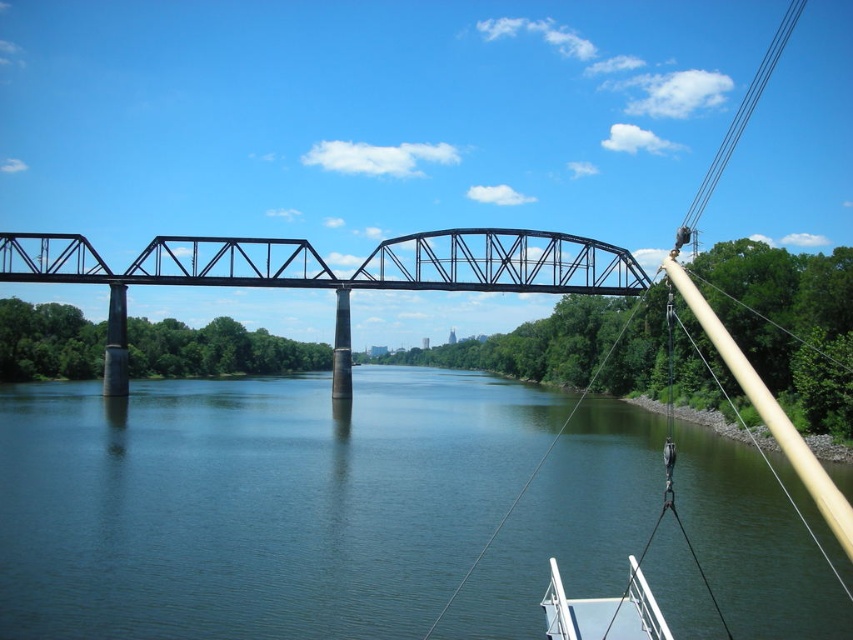
Is green smooth water at center closer to the viewer compared to white glossy boat at lower right?

That is False.

Does green smooth water at center appear over white glossy boat at lower right?

Indeed, green smooth water at center is positioned over white glossy boat at lower right.

Between point (560, 401) and point (601, 605), which one is positioned behind?

The point (560, 401) is behind.

This screenshot has height=640, width=853. Find the location of `green smooth water at center`. green smooth water at center is located at coordinates (254, 502).

Which is above, black metal train bridge at center or white glossy boat at lower right?

black metal train bridge at center is above.

Between black metal train bridge at center and white glossy boat at lower right, which one is positioned lower?

white glossy boat at lower right is below.

Describe the element at coordinates (326, 273) in the screenshot. The height and width of the screenshot is (640, 853). I see `black metal train bridge at center` at that location.

The width and height of the screenshot is (853, 640). Find the location of `black metal train bridge at center`. black metal train bridge at center is located at coordinates (326, 273).

Between green smooth water at center and black metal train bridge at center, which one appears on the right side from the viewer's perspective?

From the viewer's perspective, green smooth water at center appears more on the right side.

Consider the image. How far apart are green smooth water at center and black metal train bridge at center?

37.24 meters

Does point (94, 600) come closer to viewer compared to point (495, 234)?

That is True.

Locate an element on the screen. green smooth water at center is located at coordinates (254, 502).